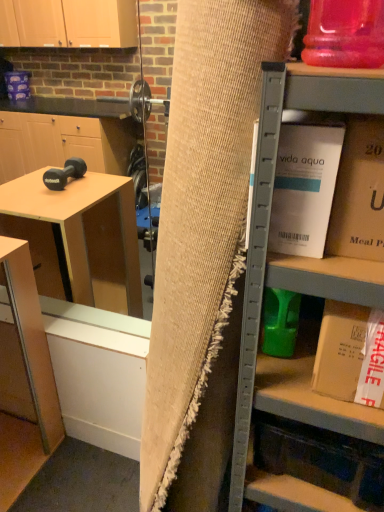
I want to click on matte wood table at lower left, so click(27, 379).

In order to face white cardboard box at upper right, should I rotate leftwards or rightwards?

Turn right approximately 19.461 degrees to face it.

Looking at this image, measure the distance between white cardboard box at upper right, which ranks as the 2th book in bottom-to-top order, and camera.

A distance of 26.22 inches exists between white cardboard box at upper right, which ranks as the 2th book in bottom-to-top order, and camera.

Where is `matte wood table at lower left`? matte wood table at lower left is located at coordinates (27, 379).

Does point (23, 300) come farther from viewer compared to point (338, 309)?

Yes.

Is white cardboard box at right, marked as the 1th book in a bottom-to-top arrangement, at the back of matte wood table at lower left?

No.

Considering the sizes of objects matte wood table at lower left and white cardboard box at right, marked as the 1th book in a bottom-to-top arrangement, in the image provided, who is bigger, matte wood table at lower left or white cardboard box at right, marked as the 1th book in a bottom-to-top arrangement,?

With larger size is matte wood table at lower left.

Does matte wood table at lower left appear on the right side of white cardboard box at right, the 3th book from the top?

Incorrect, matte wood table at lower left is not on the right side of white cardboard box at right, the 3th book from the top.

Between white cardboard box at upper right, the 2th book from the top, and white cardboard box at upper right, which one appears on the right side from the viewer's perspective?

Positioned to the right is white cardboard box at upper right.

Which is closer, [315,182] or [238,471]?

The point [315,182] is closer.

Is white cardboard box at upper right, which ranks as the 2th book in bottom-to-top order, placed right next to white cardboard box at upper right?

Yes.

Is burlap curtain at center aimed at white cardboard box at upper right, which ranks as the 2th book in bottom-to-top order?

No, burlap curtain at center is not oriented towards white cardboard box at upper right, which ranks as the 2th book in bottom-to-top order.

Considering the relative sizes of burlap curtain at center and white cardboard box at upper right, the 2th book from the top, in the image provided, is burlap curtain at center smaller than white cardboard box at upper right, the 2th book from the top,?

Incorrect, burlap curtain at center is not smaller in size than white cardboard box at upper right, the 2th book from the top.

Measure the distance between burlap curtain at center and white cardboard box at upper right, the 2th book from the top.

The distance of burlap curtain at center from white cardboard box at upper right, the 2th book from the top, is 30.43 centimeters.

From their relative heights in the image, would you say burlap curtain at center is taller or shorter than white cardboard box at upper right, which ranks as the 2th book in bottom-to-top order?

Clearly, burlap curtain at center is taller compared to white cardboard box at upper right, which ranks as the 2th book in bottom-to-top order.

You are a GUI agent. You are given a task and a screenshot of the screen. Output one action in this format:
    pyautogui.click(x=<x>, y=<y>)
    Task: Click on the curtain that is below the gold cardboard box at upper right, the 1th book in the top-to-bottom sequence (from the image's perspective)
    This screenshot has height=512, width=384.
    Given the screenshot: What is the action you would take?
    pyautogui.click(x=204, y=245)

Does point (203, 207) appear closer or farther from the camera than point (367, 228)?

Point (203, 207) is farther from the camera than point (367, 228).

Is burlap curtain at center in front of or behind gold cardboard box at upper right, the 1th book in the top-to-bottom sequence, in the image?

burlap curtain at center is positioned closer to the viewer than gold cardboard box at upper right, the 1th book in the top-to-bottom sequence.

Does burlap curtain at center have a larger size compared to gold cardboard box at upper right, the 3th book from the bottom?

Yes, burlap curtain at center is bigger than gold cardboard box at upper right, the 3th book from the bottom.

Can we say white cardboard box at upper right, which ranks as the 2th book in bottom-to-top order, lies outside matte wood table at lower left?

Yes, white cardboard box at upper right, which ranks as the 2th book in bottom-to-top order, is not within matte wood table at lower left.

This screenshot has height=512, width=384. Identify the location of the 2nd book above when counting from the matte wood table at lower left (from the image's perspective). (304, 187).

From the image's perspective, relative to matte wood table at lower left, is white cardboard box at upper right, which ranks as the 2th book in bottom-to-top order, above or below?

From the image's perspective, white cardboard box at upper right, which ranks as the 2th book in bottom-to-top order, appears above matte wood table at lower left.

Considering the positions of objects white cardboard box at upper right, the 2th book from the top, and matte wood table at lower left in the image provided, who is in front, white cardboard box at upper right, the 2th book from the top, or matte wood table at lower left?

white cardboard box at upper right, the 2th book from the top, is more forward.

Based on the photo, between white cardboard box at upper right, which ranks as the 2th book in bottom-to-top order, and gold cardboard box at upper right, the 3th book from the bottom, which one has smaller width?

white cardboard box at upper right, which ranks as the 2th book in bottom-to-top order, is thinner.

Does white cardboard box at upper right, which ranks as the 2th book in bottom-to-top order, come behind gold cardboard box at upper right, the 1th book in the top-to-bottom sequence?

Yes, white cardboard box at upper right, which ranks as the 2th book in bottom-to-top order, is further from the camera.

Is point (296, 222) farther from viewer compared to point (365, 146)?

Yes, point (296, 222) is behind point (365, 146).

Based on the photo, from a real-world perspective, is white cardboard box at upper right, which ranks as the 2th book in bottom-to-top order, physically located above or below gold cardboard box at upper right, the 1th book in the top-to-bottom sequence?

white cardboard box at upper right, which ranks as the 2th book in bottom-to-top order, is situated lower than gold cardboard box at upper right, the 1th book in the top-to-bottom sequence, in the real world.

Does point (377, 251) appear closer or farther from the camera than point (27, 250)?

Point (377, 251) is positioned closer to the camera compared to point (27, 250).

Considering the sizes of gold cardboard box at upper right, the 3th book from the bottom, and matte wood table at lower left in the image, is gold cardboard box at upper right, the 3th book from the bottom, wider or thinner than matte wood table at lower left?

Considering their sizes, gold cardboard box at upper right, the 3th book from the bottom, looks slimmer than matte wood table at lower left.

Is there a large distance between gold cardboard box at upper right, the 1th book in the top-to-bottom sequence, and matte wood table at lower left?

That's right, there is a large distance between gold cardboard box at upper right, the 1th book in the top-to-bottom sequence, and matte wood table at lower left.

Is gold cardboard box at upper right, the 3th book from the bottom, taller or shorter than matte wood table at lower left?

Considering their sizes, gold cardboard box at upper right, the 3th book from the bottom, has less height than matte wood table at lower left.

At what (x,y) coordinates should I click in order to perform the action: click on book that is the 1st one above the matte wood table at lower left (from a real-world perspective). Please return your answer as a coordinate pair (x, y). Image resolution: width=384 pixels, height=512 pixels. Looking at the image, I should click on (350, 354).

From the image's perspective, count 2nd books upward from the white cardboard box at upper right and point to it. Please provide its 2D coordinates.

[(304, 187)]

Estimate the real-world distances between objects in this image. Which object is further from white cardboard box at upper right, which ranks as the 2th book in bottom-to-top order, gold cardboard box at upper right, the 3th book from the bottom, or burlap curtain at center?

burlap curtain at center is positioned further to the anchor white cardboard box at upper right, which ranks as the 2th book in bottom-to-top order.

Based on the photo, looking at the image, which one is located further to white cardboard box at upper right, which ranks as the 2th book in bottom-to-top order, white cardboard box at upper right or gold cardboard box at upper right, the 1th book in the top-to-bottom sequence?

The object further to white cardboard box at upper right, which ranks as the 2th book in bottom-to-top order, is white cardboard box at upper right.

Looking at the image, which one is located further to white cardboard box at upper right, burlap curtain at center or white cardboard box at right, the 3th book from the top?

white cardboard box at right, the 3th book from the top, is positioned further to the anchor white cardboard box at upper right.

Based on the photo, estimate the real-world distances between objects in this image. Which object is further from gold cardboard box at upper right, the 1th book in the top-to-bottom sequence, white cardboard box at upper right or white cardboard box at right, the 3th book from the top?

white cardboard box at right, the 3th book from the top.

Which object lies further to the anchor point white cardboard box at upper right, which ranks as the 2th book in bottom-to-top order, matte wood table at lower left or burlap curtain at center?

The object further to white cardboard box at upper right, which ranks as the 2th book in bottom-to-top order, is matte wood table at lower left.

Considering their positions, is matte wood table at lower left positioned closer to white cardboard box at upper right, the 2th book from the top, than white cardboard box at right, the 3th book from the top?

Based on the image, white cardboard box at right, the 3th book from the top, appears to be nearer to white cardboard box at upper right, the 2th book from the top.

Which object lies nearer to the anchor point white cardboard box at upper right, burlap curtain at center or white cardboard box at upper right, which ranks as the 2th book in bottom-to-top order?

white cardboard box at upper right, which ranks as the 2th book in bottom-to-top order.

Based on their spatial positions, is white cardboard box at right, the 3th book from the top, or gold cardboard box at upper right, the 1th book in the top-to-bottom sequence, further from white cardboard box at upper right, which ranks as the 2th book in bottom-to-top order?

white cardboard box at right, the 3th book from the top, is further to white cardboard box at upper right, which ranks as the 2th book in bottom-to-top order.

At what (x,y) coordinates should I click in order to perform the action: click on curtain that lies between gold cardboard box at upper right, the 1th book in the top-to-bottom sequence, and white cardboard box at upper right from top to bottom. Please return your answer as a coordinate pair (x, y). The width and height of the screenshot is (384, 512). Looking at the image, I should click on (204, 245).

Identify the location of book located between matte wood table at lower left and gold cardboard box at upper right, the 1th book in the top-to-bottom sequence, in the left-right direction. The height and width of the screenshot is (512, 384). (304, 187).

I want to click on curtain between white cardboard box at upper right, the 2th book from the top, and white cardboard box at upper right, in the vertical direction, so [x=204, y=245].

Image resolution: width=384 pixels, height=512 pixels. What are the coordinates of `book that lies between white cardboard box at upper right, which ranks as the 2th book in bottom-to-top order, and white cardboard box at upper right from top to bottom` in the screenshot? It's located at (350, 354).